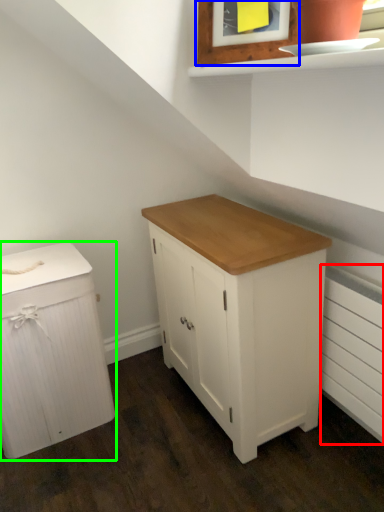
Question: Which is farther away from radiator (highlighted by a red box)? picture frame (highlighted by a blue box) or chest of drawers (highlighted by a green box)?

Choices:
 (A) picture frame
 (B) chest of drawers

Answer: (B)